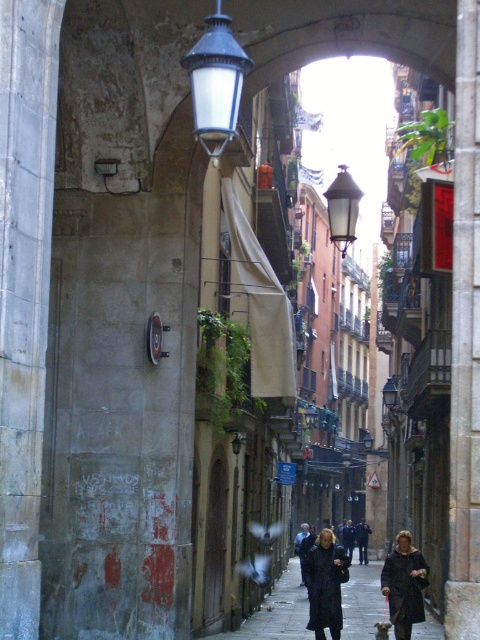
Does matte glass lamp at upper center have a larger size compared to dark brown leather coat at center?

Actually, matte glass lamp at upper center might be smaller than dark brown leather coat at center.

The width and height of the screenshot is (480, 640). What do you see at coordinates (216, 83) in the screenshot?
I see `matte glass lamp at upper center` at bounding box center [216, 83].

Describe the element at coordinates (216, 83) in the screenshot. This screenshot has width=480, height=640. I see `matte glass lamp at upper center` at that location.

This screenshot has width=480, height=640. Find the location of `matte glass lamp at upper center`. matte glass lamp at upper center is located at coordinates [216, 83].

Can you confirm if smooth asphalt sidewalk at center is smaller than dark brown leather coat at center?

Actually, smooth asphalt sidewalk at center might be larger than dark brown leather coat at center.

Describe the element at coordinates (276, 612) in the screenshot. This screenshot has height=640, width=480. I see `smooth asphalt sidewalk at center` at that location.

Find the location of a particular element. The height and width of the screenshot is (640, 480). smooth asphalt sidewalk at center is located at coordinates (276, 612).

Does matte glass lamp at upper center have a greater height compared to matte black streetlamp at upper center?

No.

The width and height of the screenshot is (480, 640). What do you see at coordinates (216, 83) in the screenshot?
I see `matte glass lamp at upper center` at bounding box center [216, 83].

Is point (232, 99) in front of point (344, 216)?

Yes, point (232, 99) is closer to viewer.

This screenshot has width=480, height=640. What are the coordinates of `matte glass lamp at upper center` in the screenshot? It's located at (216, 83).